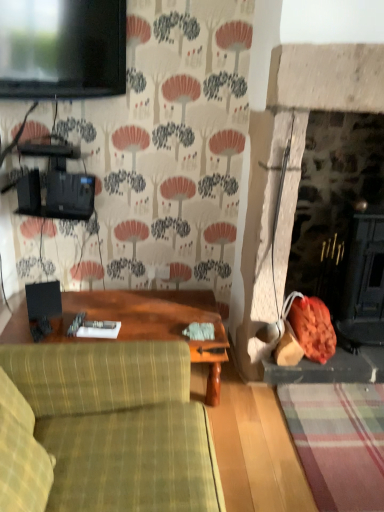
Question: From a real-world perspective, is wooden table at center beneath matte black tv at upper left?

Choices:
 (A) yes
 (B) no

Answer: (A)

Question: Is wooden table at center further to the viewer compared to matte black tv at upper left?

Choices:
 (A) no
 (B) yes

Answer: (B)

Question: Does wooden table at center appear on the right side of matte black tv at upper left?

Choices:
 (A) no
 (B) yes

Answer: (B)

Question: Could you tell me if wooden table at center is turned towards matte black tv at upper left?

Choices:
 (A) yes
 (B) no

Answer: (B)

Question: Is matte black tv at upper left at the back of wooden table at center?

Choices:
 (A) yes
 (B) no

Answer: (B)

Question: Is wooden table at center situated inside green plaid fabric couch at lower left or outside?

Choices:
 (A) outside
 (B) inside

Answer: (A)

Question: Considering the positions of point (66, 317) and point (147, 503), is point (66, 317) closer or farther from the camera than point (147, 503)?

Choices:
 (A) farther
 (B) closer

Answer: (A)

Question: Considering the positions of wooden table at center and green plaid fabric couch at lower left in the image, is wooden table at center bigger or smaller than green plaid fabric couch at lower left?

Choices:
 (A) big
 (B) small

Answer: (B)

Question: Considering the positions of wooden table at center and green plaid fabric couch at lower left in the image, is wooden table at center taller or shorter than green plaid fabric couch at lower left?

Choices:
 (A) tall
 (B) short

Answer: (B)

Question: Would you say matte black tv at upper left is to the left or to the right of green plaid fabric couch at lower left in the picture?

Choices:
 (A) left
 (B) right

Answer: (A)

Question: Is matte black tv at upper left situated inside green plaid fabric couch at lower left or outside?

Choices:
 (A) inside
 (B) outside

Answer: (B)

Question: From a real-world perspective, is matte black tv at upper left positioned above or below green plaid fabric couch at lower left?

Choices:
 (A) below
 (B) above

Answer: (B)

Question: Looking at the image, does matte black tv at upper left seem bigger or smaller compared to green plaid fabric couch at lower left?

Choices:
 (A) small
 (B) big

Answer: (A)

Question: Is wooden table at center to the left or to the right of matte black tv at upper left in the image?

Choices:
 (A) left
 (B) right

Answer: (B)

Question: Considering the positions of wooden table at center and matte black tv at upper left in the image, is wooden table at center wider or thinner than matte black tv at upper left?

Choices:
 (A) wide
 (B) thin

Answer: (A)